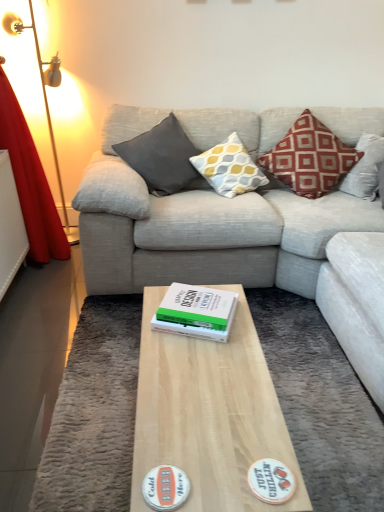
Locate an element on the screen. The image size is (384, 512). vacant space behind matte white coaster at lower center, placed as the 1th sticker when sorted from left to right is located at coordinates (180, 424).